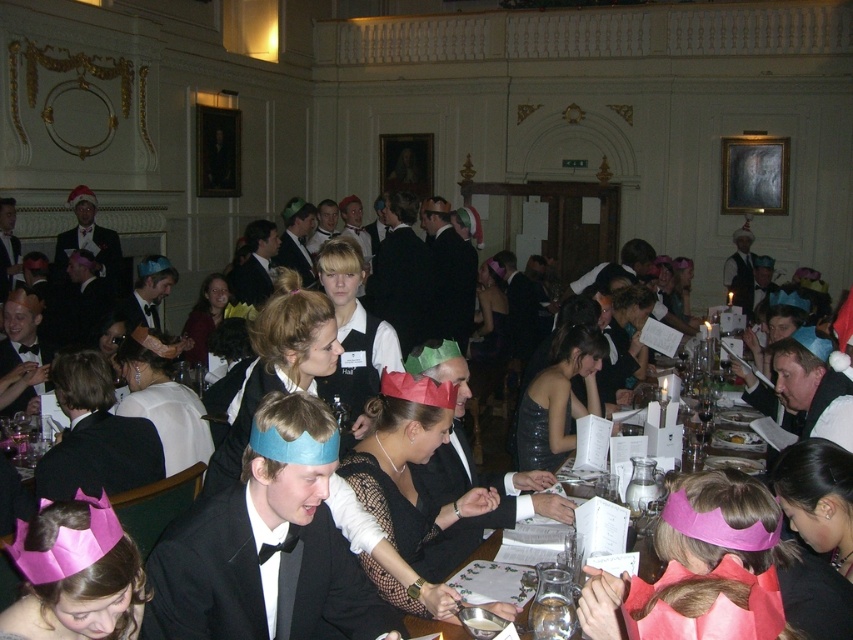
Question: Can you confirm if pink paper crown at lower left is positioned to the left of pink paper crown at center?

Choices:
 (A) yes
 (B) no

Answer: (A)

Question: Which point is closer to the camera?

Choices:
 (A) pink paper crown at lower left
 (B) pink paper crown at center

Answer: (A)

Question: Is pink paper crown at lower left wider than pink paper crown at center?

Choices:
 (A) yes
 (B) no

Answer: (B)

Question: Is the position of pink paper crown at lower left more distant than that of pink paper crown at center?

Choices:
 (A) yes
 (B) no

Answer: (B)